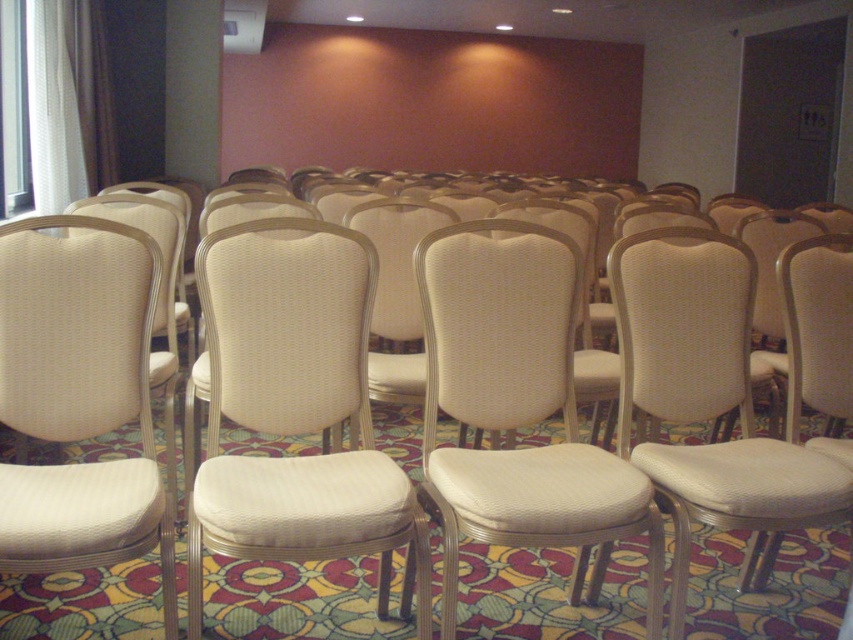
Does white woven chair at center appear over white fabric chair at center?

Correct, white woven chair at center is located above white fabric chair at center.

Is white woven chair at center shorter than white fabric chair at center?

Incorrect, white woven chair at center's height does not fall short of white fabric chair at center's.

This screenshot has width=853, height=640. What do you see at coordinates (294, 406) in the screenshot? I see `white woven chair at center` at bounding box center [294, 406].

Image resolution: width=853 pixels, height=640 pixels. I want to click on white woven chair at center, so click(x=294, y=406).

Who is positioned more to the right, white woven chair at center or white fabric chair at right?

From the viewer's perspective, white fabric chair at right appears more on the right side.

What are the coordinates of `white woven chair at center` in the screenshot? It's located at (294, 406).

Which is more to the left, white fabric chair at center or white fabric chair at right?

From the viewer's perspective, white fabric chair at center appears more on the left side.

Which is above, white fabric chair at center or white fabric chair at right?

white fabric chair at right is above.

Which is behind, point (738, 332) or point (817, 444)?

The point (738, 332) is more distant.

Identify the location of white fabric chair at center. (706, 397).